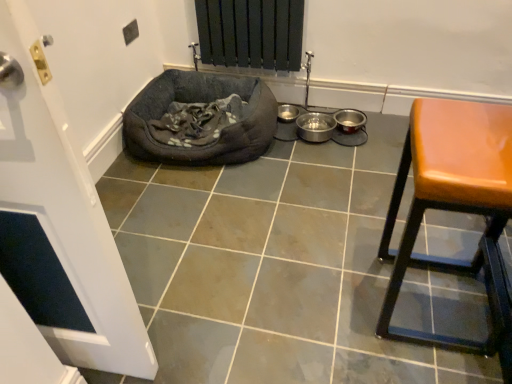
Image resolution: width=512 pixels, height=384 pixels. What do you see at coordinates (201, 119) in the screenshot?
I see `dark gray fabric dog bed at lower left` at bounding box center [201, 119].

Find the location of a particular element. Image resolution: width=512 pixels, height=384 pixels. matte gray tile at center is located at coordinates (271, 266).

I want to click on dark gray fabric dog bed at lower left, so (201, 119).

Is leatherette stool at right to the left of dark gray fabric dog bed at lower left from the viewer's perspective?

Incorrect, leatherette stool at right is not on the left side of dark gray fabric dog bed at lower left.

From the image's perspective, between leatherette stool at right and dark gray fabric dog bed at lower left, who is located below?

leatherette stool at right appears lower in the image.

Do you think leatherette stool at right is within dark gray fabric dog bed at lower left, or outside of it?

leatherette stool at right exists outside the volume of dark gray fabric dog bed at lower left.

Which is in front, dark gray fabric dog bed at lower left or matte gray tile at center?

matte gray tile at center is closer to the camera.

Can you confirm if dark gray fabric dog bed at lower left is wider than matte gray tile at center?

Incorrect, the width of dark gray fabric dog bed at lower left does not surpass that of matte gray tile at center.

Between dark gray fabric dog bed at lower left and matte gray tile at center, which one appears on the right side from the viewer's perspective?

From the viewer's perspective, matte gray tile at center appears more on the right side.

Which is more to the right, matte gray tile at center or leatherette stool at right?

Positioned to the right is leatherette stool at right.

Is matte gray tile at center touching leatherette stool at right?

No, matte gray tile at center is not with leatherette stool at right.

Looking at the image, does matte gray tile at center seem bigger or smaller compared to leatherette stool at right?

Considering their sizes, matte gray tile at center takes up more space than leatherette stool at right.

From the picture: Is dark gray fabric dog bed at lower left looking in the opposite direction of leatherette stool at right?

That's not correct — dark gray fabric dog bed at lower left is not looking away from leatherette stool at right.

Consider the image. Can you confirm if dark gray fabric dog bed at lower left is bigger than leatherette stool at right?

Yes, dark gray fabric dog bed at lower left is bigger than leatherette stool at right.

Find the location of `dog bed that is behind the leatherette stool at right`. dog bed that is behind the leatherette stool at right is located at coordinates (201, 119).

Considering the points (234, 143) and (436, 132), which point is in front, point (234, 143) or point (436, 132)?

Point (436, 132)

Which is more to the left, matte gray tile at center or dark gray fabric dog bed at lower left?

From the viewer's perspective, dark gray fabric dog bed at lower left appears more on the left side.

Considering the sizes of objects matte gray tile at center and dark gray fabric dog bed at lower left in the image provided, who is thinner, matte gray tile at center or dark gray fabric dog bed at lower left?

dark gray fabric dog bed at lower left is thinner.

Consider the image. Which is more distant, (479,300) or (207,143)?

The point (207,143) is farther.

Is matte gray tile at center inside or outside of dark gray fabric dog bed at lower left?

matte gray tile at center is not inside dark gray fabric dog bed at lower left, it's outside.

How distant is leatherette stool at right from matte gray tile at center?

leatherette stool at right is 13.97 inches away from matte gray tile at center.

How many degrees apart are the facing directions of leatherette stool at right and matte gray tile at center?

There is a 89.3-degree angle between the facing directions of leatherette stool at right and matte gray tile at center.

Is point (389, 256) closer to viewer compared to point (222, 324)?

No, it is behind (222, 324).

From their relative heights in the image, would you say leatherette stool at right is taller or shorter than matte gray tile at center?

leatherette stool at right is taller than matte gray tile at center.

This screenshot has width=512, height=384. Identify the location of furniture above the dark gray fabric dog bed at lower left (from a real-world perspective). (453, 204).

The height and width of the screenshot is (384, 512). I want to click on tile to the right of dark gray fabric dog bed at lower left, so click(271, 266).

Estimate the real-world distances between objects in this image. Which object is further from dark gray fabric dog bed at lower left, leatherette stool at right or matte gray tile at center?

The object further to dark gray fabric dog bed at lower left is leatherette stool at right.

Considering their positions, is dark gray fabric dog bed at lower left positioned closer to leatherette stool at right than matte gray tile at center?

The object closer to leatherette stool at right is matte gray tile at center.

From the image, which object appears to be nearer to dark gray fabric dog bed at lower left, matte gray tile at center or leatherette stool at right?

Based on the image, matte gray tile at center appears to be nearer to dark gray fabric dog bed at lower left.

Considering their positions, is leatherette stool at right positioned closer to matte gray tile at center than dark gray fabric dog bed at lower left?

leatherette stool at right.

Considering their positions, is matte gray tile at center positioned closer to leatherette stool at right than dark gray fabric dog bed at lower left?

Based on the image, matte gray tile at center appears to be nearer to leatherette stool at right.

From the image, which object appears to be farther from matte gray tile at center, dark gray fabric dog bed at lower left or leatherette stool at right?

dark gray fabric dog bed at lower left lies further to matte gray tile at center than the other object.

The image size is (512, 384). I want to click on tile between leatherette stool at right and dark gray fabric dog bed at lower left along the z-axis, so click(271, 266).